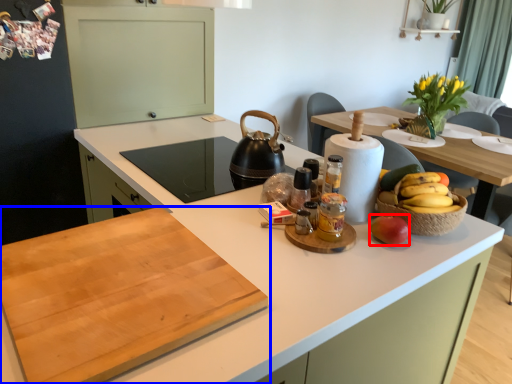
Question: Which point is closer to the camera, apple (highlighted by a red box) or countertop (highlighted by a blue box)?

Choices:
 (A) apple
 (B) countertop

Answer: (B)